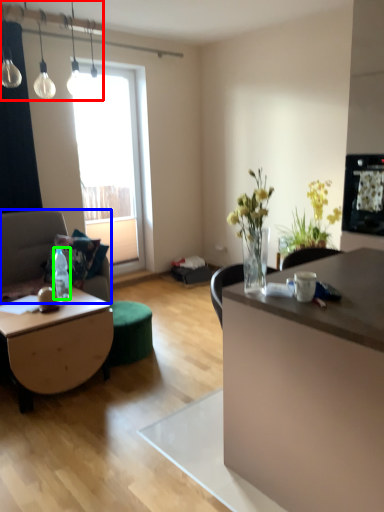
Question: Which object is the farthest from lamp (highlighted by a red box)? Choose among these: studio couch (highlighted by a blue box) or bottle (highlighted by a green box).

Choices:
 (A) studio couch
 (B) bottle

Answer: (B)